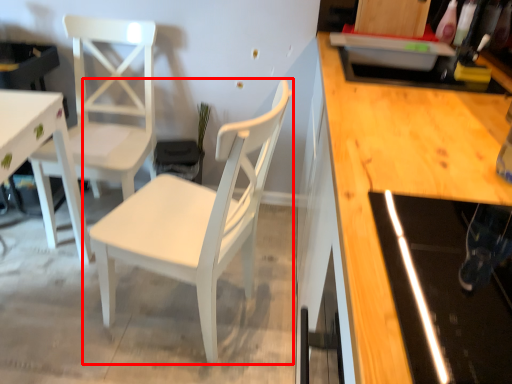
Question: From the image's perspective, what is the correct spatial relationship of chair (annotated by the red box) in relation to chair?

Choices:
 (A) above
 (B) below

Answer: (B)